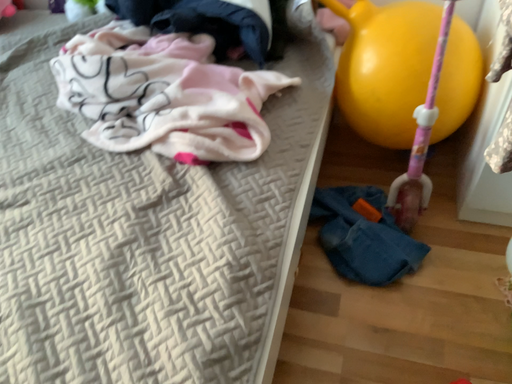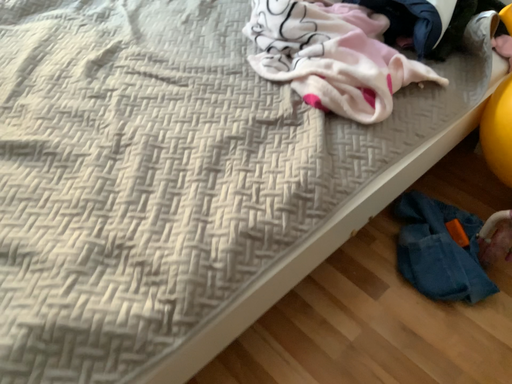
Question: How did the camera likely rotate when shooting the video?

Choices:
 (A) rotated left
 (B) rotated right

Answer: (A)